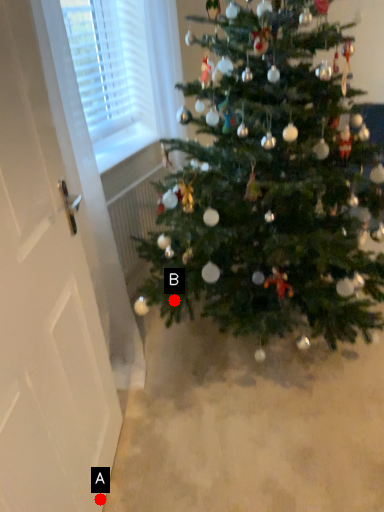
Question: Two points are circled on the image, labeled by A and B beside each circle. Which point is closer to the camera?

Choices:
 (A) A is closer
 (B) B is closer

Answer: (A)